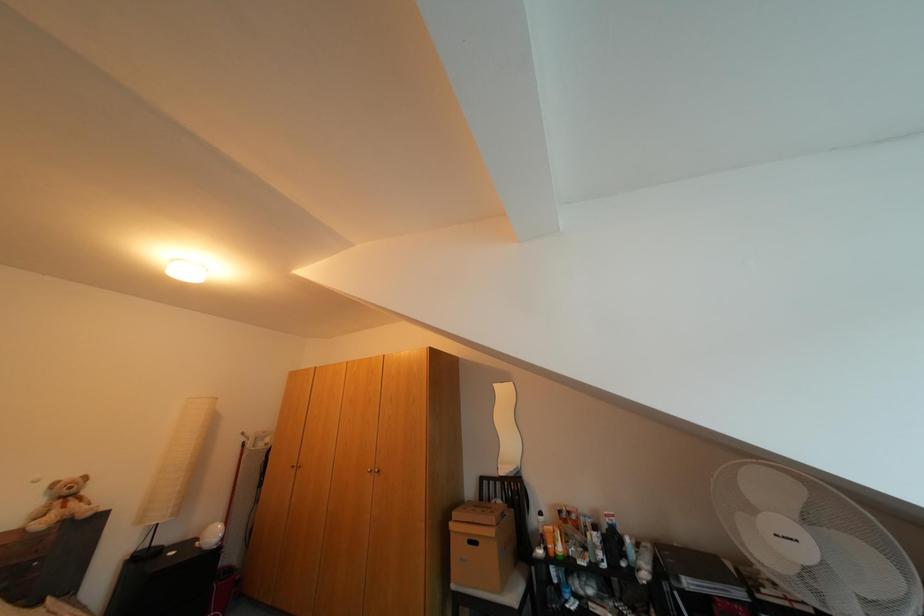
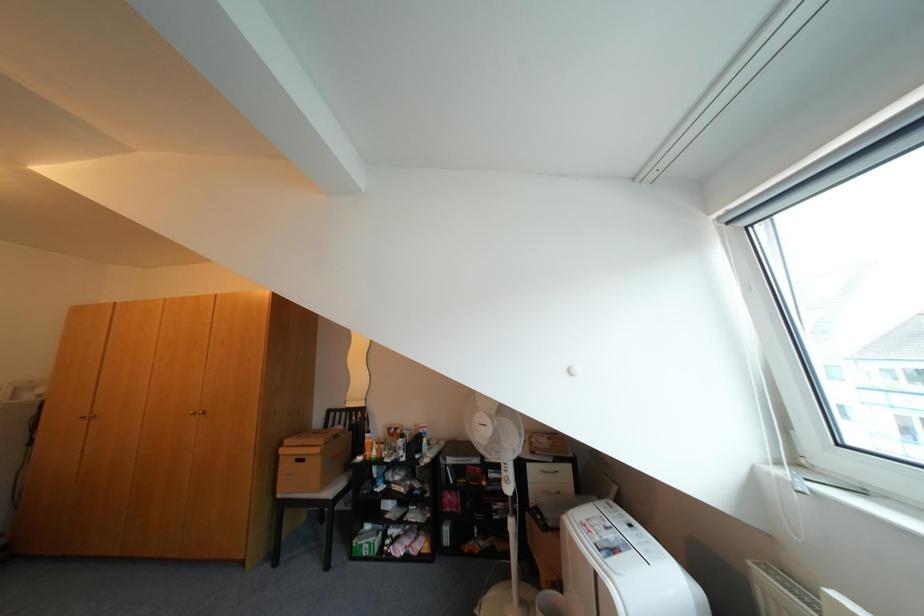
Question: The images are taken continuously from a first-person perspective. In which direction is your viewpoint rotating?

Choices:
 (A) Left
 (B) Right
 (C) Up
 (D) Down

Answer: (B)